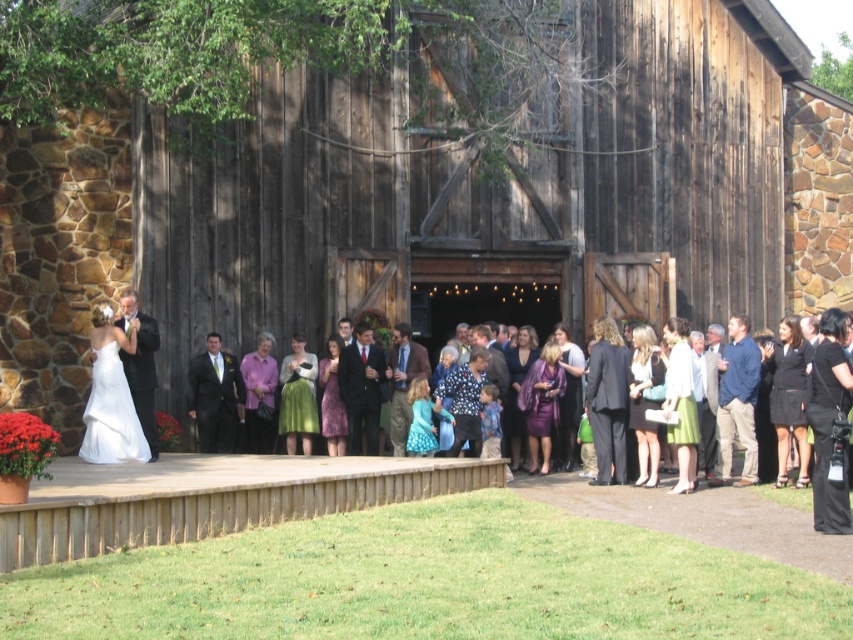
Question: In this image, where is dark wood barn at center located relative to blue denim shirt at right?

Choices:
 (A) below
 (B) above

Answer: (B)

Question: Can you confirm if dark wood barn at center is bigger than white satin dress at center?

Choices:
 (A) yes
 (B) no

Answer: (A)

Question: Does white satin dress at center appear under matte black suit at left?

Choices:
 (A) no
 (B) yes

Answer: (B)

Question: Which of the following is the farthest from the observer?

Choices:
 (A) matte black suit at center
 (B) white satin dress at center

Answer: (A)

Question: Among these points, which one is farthest from the camera?

Choices:
 (A) (120, 328)
 (B) (376, 435)

Answer: (B)

Question: Based on their relative distances, which object is farther from the dark wood barn at center?

Choices:
 (A) matte black suit at left
 (B) shiny black suit at center
 (C) blue denim shirt at right
 (D) matte black suit at center

Answer: (C)